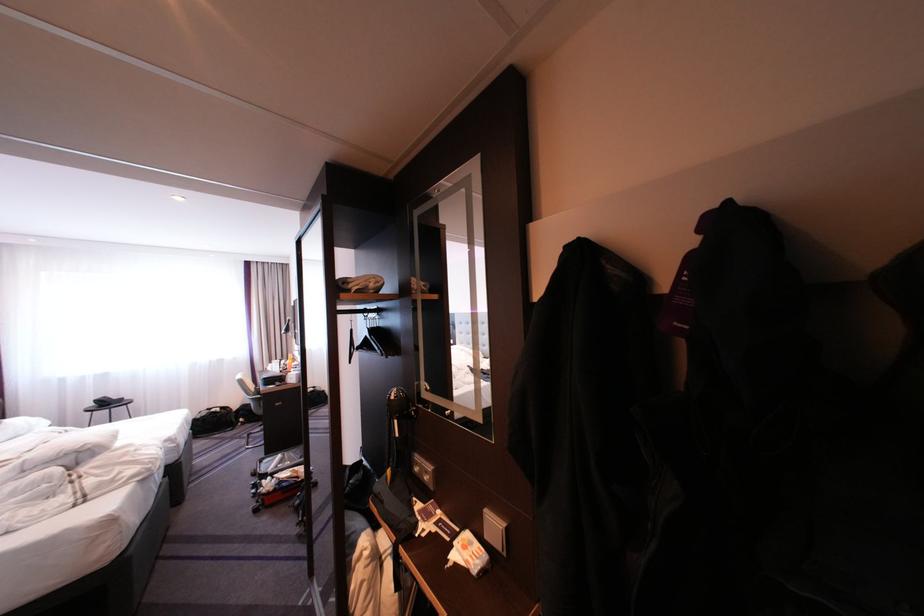
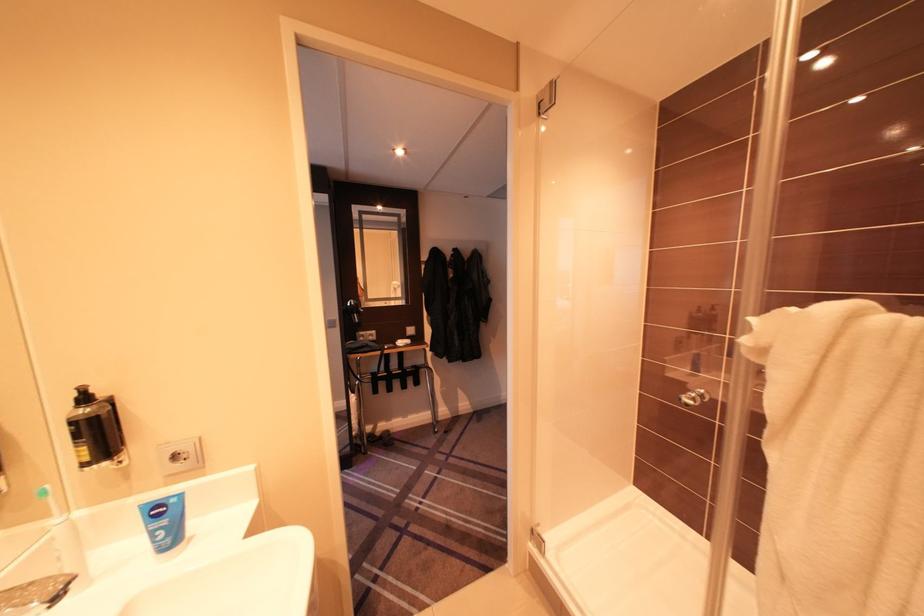
Find the pixel in the second image that matches (x=429, y=459) in the first image.

(372, 334)